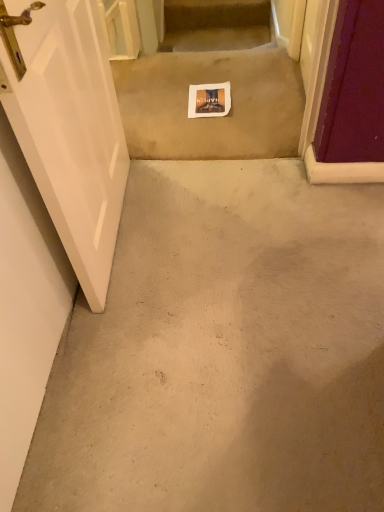
Describe the element at coordinates (215, 25) in the screenshot. The width and height of the screenshot is (384, 512). I see `carpeted stairs at upper center` at that location.

What is the approximate width of carpeted stairs at upper center?

9.40 inches.

Find the location of a particular element. beige carpet at center is located at coordinates (212, 82).

Describe the element at coordinates (209, 100) in the screenshot. I see `white paper at center` at that location.

What do you see at coordinates (69, 129) in the screenshot?
I see `white glossy door at left` at bounding box center [69, 129].

What are the coordinates of `carpeted stairs at upper center` in the screenshot? It's located at (215, 25).

Is beige carpet at center not close to white paper at center?

No, there isn't a large distance between beige carpet at center and white paper at center.

Is point (253, 56) closer or farther from the camera than point (195, 104)?

Clearly, point (253, 56) is more distant from the camera than point (195, 104).

Considering the sizes of beige carpet at center and white paper at center in the image, is beige carpet at center bigger or smaller than white paper at center?

In the image, beige carpet at center appears to be larger than white paper at center.

From the image's perspective, between beige carpet at center and white paper at center, who is located below?

white paper at center appears lower in the image.

From the image's perspective, would you say carpeted stairs at upper center is positioned over white paper at center?

Correct, carpeted stairs at upper center appears higher than white paper at center in the image.

Is carpeted stairs at upper center facing towards white paper at center?

Yes, carpeted stairs at upper center faces towards white paper at center.

Identify the location of stairs below the white paper at center (from a real-world perspective). (215, 25).

Considering the relative sizes of carpeted stairs at upper center and white paper at center in the image provided, is carpeted stairs at upper center wider than white paper at center?

No, carpeted stairs at upper center is not wider than white paper at center.

Where is `door above the carpeted stairs at upper center (from a real-world perspective)`? This screenshot has height=512, width=384. door above the carpeted stairs at upper center (from a real-world perspective) is located at coordinates (69, 129).

Would you say carpeted stairs at upper center is a long distance from white glossy door at left?

Yes, carpeted stairs at upper center and white glossy door at left are quite far apart.

Is carpeted stairs at upper center further to the viewer compared to white glossy door at left?

Yes, carpeted stairs at upper center is behind white glossy door at left.

Is carpeted stairs at upper center located outside white glossy door at left?

carpeted stairs at upper center lies outside white glossy door at left's area.

Looking at their sizes, would you say beige carpet at center is wider or thinner than white glossy door at left?

Clearly, beige carpet at center has more width compared to white glossy door at left.

Consider the image. Is beige carpet at center not inside white glossy door at left?

Absolutely, beige carpet at center is external to white glossy door at left.

Which of these two, beige carpet at center or white glossy door at left, stands shorter?

With less height is beige carpet at center.

Considering the points (191, 102) and (204, 38), which point is in front, point (191, 102) or point (204, 38)?

The point (191, 102) is closer.

Is white paper at center next to carpeted stairs at upper center?

No, white paper at center is not touching carpeted stairs at upper center.

Between point (230, 29) and point (206, 74), which one is positioned in front?

The point (206, 74) is more forward.

Based on the photo, is carpeted stairs at upper center not near beige carpet at center?

carpeted stairs at upper center is far away from beige carpet at center.

Considering the relative sizes of carpeted stairs at upper center and beige carpet at center in the image provided, is carpeted stairs at upper center shorter than beige carpet at center?

No, carpeted stairs at upper center is not shorter than beige carpet at center.

Is carpeted stairs at upper center bigger or smaller than beige carpet at center?

carpeted stairs at upper center is smaller than beige carpet at center.

Is white glossy door at left looking in the opposite direction of white paper at center?

No, white glossy door at left's orientation is not away from white paper at center.

Considering the relative sizes of white glossy door at left and white paper at center in the image provided, is white glossy door at left wider than white paper at center?

No, white glossy door at left is not wider than white paper at center.

Is white glossy door at left bigger than white paper at center?

Yes.

In the image, there is a white paper at center. In order to click on stairwell below it (from a real-world perspective) in this screenshot , I will do `click(212, 82)`.

This screenshot has height=512, width=384. Find the location of `postcard below the carpeted stairs at upper center (from the image's perspective)`. postcard below the carpeted stairs at upper center (from the image's perspective) is located at coordinates (209, 100).

Based on their spatial positions, is carpeted stairs at upper center or white glossy door at left closer to beige carpet at center?

Among the two, white glossy door at left is located nearer to beige carpet at center.

When comparing their distances from carpeted stairs at upper center, does white glossy door at left or white paper at center seem closer?

white paper at center lies closer to carpeted stairs at upper center than the other object.

From the image, which object appears to be nearer to white paper at center, white glossy door at left or beige carpet at center?

The object closer to white paper at center is beige carpet at center.

Considering their positions, is carpeted stairs at upper center positioned further to white glossy door at left than beige carpet at center?

carpeted stairs at upper center lies further to white glossy door at left than the other object.

Estimate the real-world distances between objects in this image. Which object is further from carpeted stairs at upper center, white glossy door at left or beige carpet at center?

The object further to carpeted stairs at upper center is white glossy door at left.

Which object lies further to the anchor point white paper at center, carpeted stairs at upper center or white glossy door at left?

carpeted stairs at upper center is further to white paper at center.

Estimate the real-world distances between objects in this image. Which object is further from white glossy door at left, white paper at center or beige carpet at center?

Among the two, white paper at center is located further to white glossy door at left.

Based on their spatial positions, is white glossy door at left or carpeted stairs at upper center further from beige carpet at center?

carpeted stairs at upper center is positioned further to the anchor beige carpet at center.

The width and height of the screenshot is (384, 512). Find the location of `stairwell positioned between white glossy door at left and carpeted stairs at upper center from near to far`. stairwell positioned between white glossy door at left and carpeted stairs at upper center from near to far is located at coordinates (212, 82).

At what (x,y) coordinates should I click in order to perform the action: click on stairwell between white glossy door at left and white paper at center from front to back. Please return your answer as a coordinate pair (x, y). Image resolution: width=384 pixels, height=512 pixels. Looking at the image, I should click on (212, 82).

I want to click on postcard positioned between white glossy door at left and carpeted stairs at upper center from near to far, so click(x=209, y=100).

Image resolution: width=384 pixels, height=512 pixels. Identify the location of postcard between beige carpet at center and carpeted stairs at upper center along the z-axis. (209, 100).